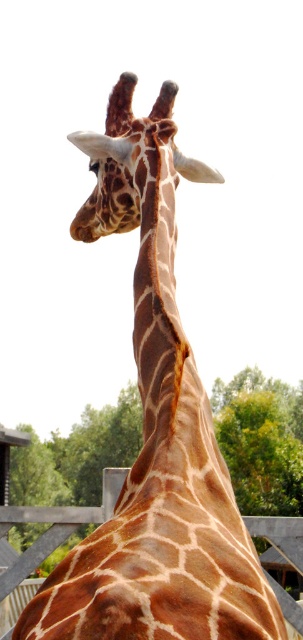
You are a photographer trying to capture the brown textured neck at center and the brown wooden fence at lower center in a single shot. Based on the scene, which object is closer to the camera?

The brown textured neck at center is closer to the camera since it is in front of the brown wooden fence at lower center.

You are a photographer trying to capture the spotted fur giraffe head at center and the brown wooden fence at lower center in the same frame. Based on their sizes in the image, which one will appear larger in your photo?

The spotted fur giraffe head at center appears larger in the image than the brown wooden fence at lower center because it is closer to the camera, making it occupy more space in the frame.